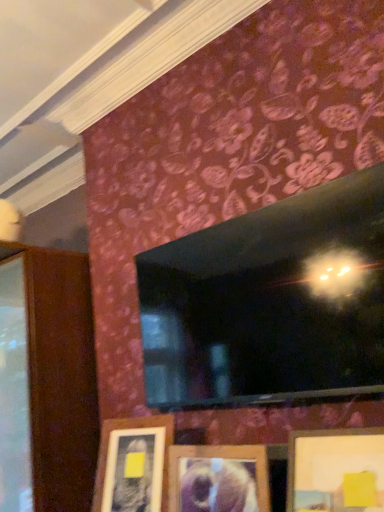
Question: Can you confirm if wooden picture frame at lower center, the 3th picture frame viewed from the right, is taller than wooden picture frame at lower center, the first picture frame viewed from the right?

Choices:
 (A) no
 (B) yes

Answer: (B)

Question: Does wooden picture frame at lower center, the 3th picture frame viewed from the right, appear on the right side of wooden picture frame at lower center, the first picture frame viewed from the right?

Choices:
 (A) no
 (B) yes

Answer: (A)

Question: Could wooden picture frame at lower center, the first picture frame viewed from the right, be considered to be inside wooden picture frame at lower center, the 3th picture frame viewed from the right?

Choices:
 (A) yes
 (B) no

Answer: (B)

Question: Is wooden picture frame at lower center, which is the first picture frame in left-to-right order, placed right next to wooden picture frame at lower center, the first picture frame viewed from the right?

Choices:
 (A) yes
 (B) no

Answer: (B)

Question: Is wooden picture frame at lower center, which is the first picture frame in left-to-right order, not inside wooden picture frame at lower center, the first picture frame viewed from the right?

Choices:
 (A) yes
 (B) no

Answer: (A)

Question: Considering the relative sizes of wooden picture frame at lower center, which is the first picture frame in left-to-right order, and wooden picture frame at lower center, the first picture frame viewed from the right, in the image provided, is wooden picture frame at lower center, which is the first picture frame in left-to-right order, thinner than wooden picture frame at lower center, the first picture frame viewed from the right,?

Choices:
 (A) yes
 (B) no

Answer: (A)

Question: Does wooden picture frame at lower center, which is the first picture frame in left-to-right order, come behind wooden picture frame at center, the second picture frame from the left?

Choices:
 (A) yes
 (B) no

Answer: (A)

Question: Considering the relative sizes of wooden picture frame at lower center, which is the first picture frame in left-to-right order, and wooden picture frame at center, the second picture frame positioned from the right, in the image provided, is wooden picture frame at lower center, which is the first picture frame in left-to-right order, bigger than wooden picture frame at center, the second picture frame positioned from the right,?

Choices:
 (A) yes
 (B) no

Answer: (A)

Question: Is wooden picture frame at lower center, which is the first picture frame in left-to-right order, aimed at wooden picture frame at center, the second picture frame positioned from the right?

Choices:
 (A) no
 (B) yes

Answer: (A)

Question: Is wooden picture frame at center, the second picture frame positioned from the right, a part of wooden picture frame at lower center, the 3th picture frame viewed from the right?

Choices:
 (A) no
 (B) yes

Answer: (A)

Question: Can you confirm if wooden picture frame at lower center, the 3th picture frame viewed from the right, is shorter than wooden picture frame at center, the second picture frame positioned from the right?

Choices:
 (A) yes
 (B) no

Answer: (B)

Question: Can you confirm if wooden picture frame at lower center, which is the first picture frame in left-to-right order, is wider than wooden picture frame at center, the second picture frame positioned from the right?

Choices:
 (A) no
 (B) yes

Answer: (B)

Question: Are wooden picture frame at lower center, which ranks as the 3th picture frame in left-to-right order, and wooden picture frame at lower center, the 3th picture frame viewed from the right, located far from each other?

Choices:
 (A) no
 (B) yes

Answer: (A)